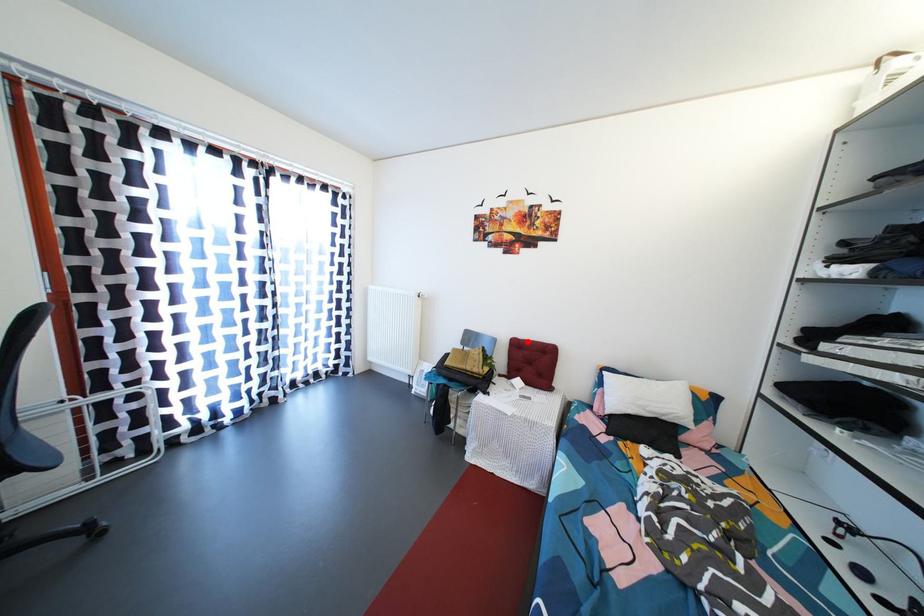
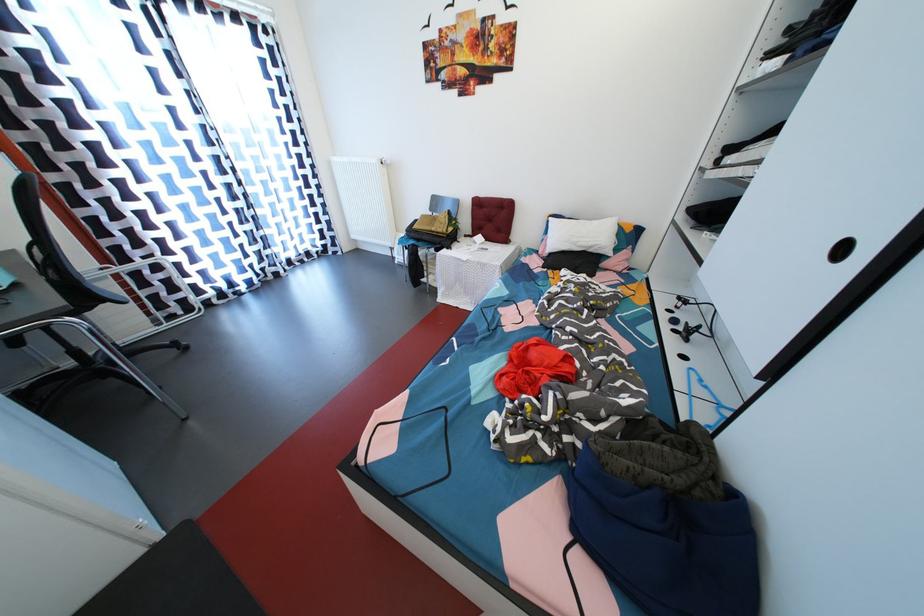
Question: I am providing you with two images of the same scene from different viewpoints. A red point is shown in image1. For the corresponding object point in image2, is it positioned nearer or farther from the camera?

Choices:
 (A) Nearer
 (B) Farther

Answer: (A)